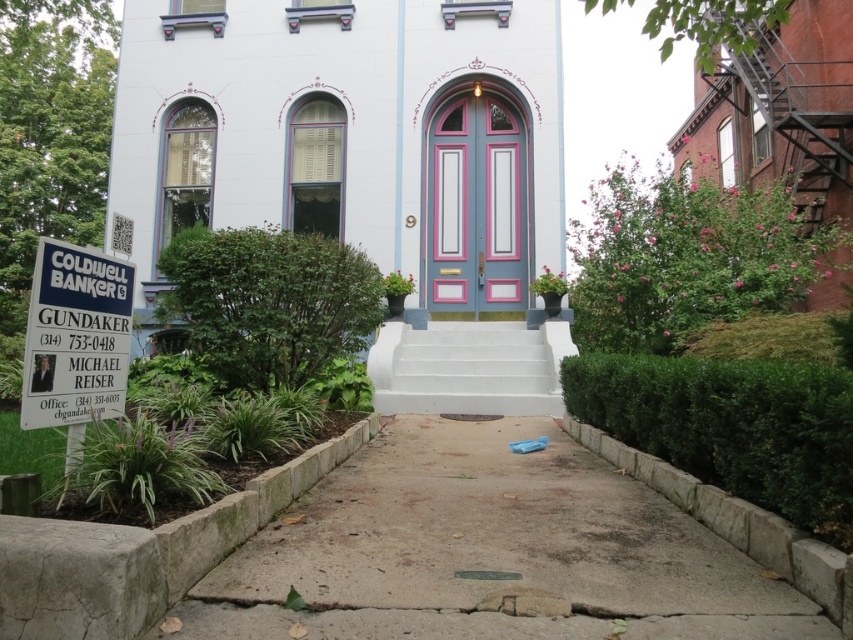
You are standing on the gray concrete pavement at center and want to reach the white concrete stairs at center. Which direction should you move to get closer to the stairs?

Since the gray concrete pavement at center is closer to the viewer than the white concrete stairs at center, you should move forward towards the stairs to get closer to them.

You are standing at the entrance of the Victorian house and want to place a small potted plant between the two points labeled point (474, 436) and point (473, 362). Based on their positions, which point should the plant be closer to in order to be positioned in front of both points?

The plant should be closer to point (474, 436) because it is in front of point (473, 362).

You are a real estate agent standing in front of the house and need to place a new sign. The new sign must be placed so that it is smaller than the existing white plastic coldwell banker sign at left. Where should you place the new sign relative to the matte white church at center?

The matte white church at center is larger than the white plastic coldwell banker sign at left. To ensure the new sign is smaller than the existing one, place it closer to the viewer than the white plastic coldwell banker sign at left.